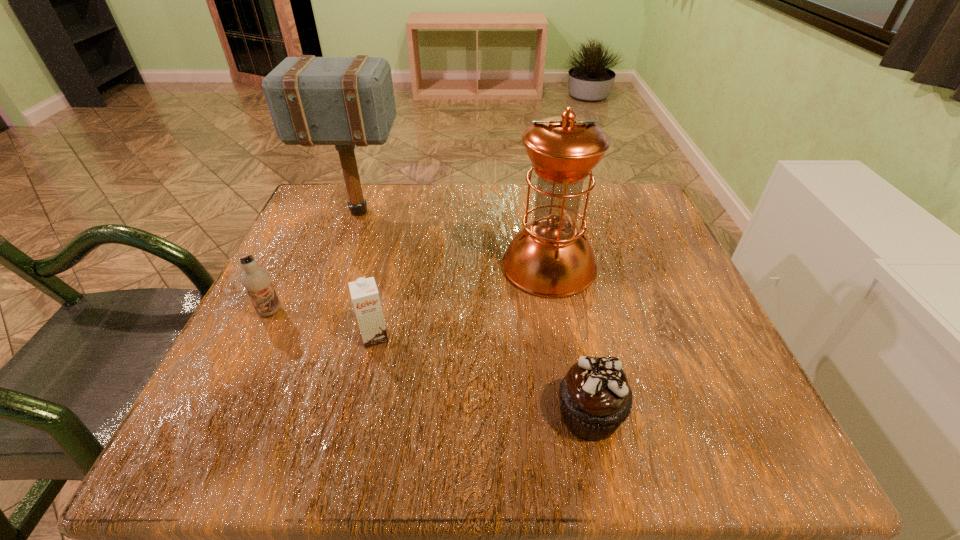
Locate an element on the screen. free space between the farther chocolate milk and the fourth nearest object is located at coordinates (410, 288).

Find the location of a particular element. free space that is in between the third farthest object and the nearest object is located at coordinates (430, 363).

You are a GUI agent. You are given a task and a screenshot of the screen. Output one action in this format:
    pyautogui.click(x=<x>, y=<y>)
    Task: Click on the free spot between the third farthest object and the shortest object
    This screenshot has width=960, height=540.
    Given the screenshot: What is the action you would take?
    pyautogui.click(x=430, y=363)

Identify the location of vacant area between the left chocolate milk and the right chocolate milk. Image resolution: width=960 pixels, height=540 pixels. pos(323,324).

At what (x,y) coordinates should I click in order to perform the action: click on empty space between the mallet and the fourth nearest object. Please return your answer as a coordinate pair (x, y). This screenshot has width=960, height=540. Looking at the image, I should click on (453, 239).

Where is `the second closest object to the farthest object`? This screenshot has width=960, height=540. the second closest object to the farthest object is located at coordinates (257, 281).

This screenshot has width=960, height=540. Identify the location of the closest object to the second nearest object. (257, 281).

Find the location of `free point that satisfies the following two spatial constraints: 1. on the striking surface of the shortest object; 2. on the left side of the farthest object`. free point that satisfies the following two spatial constraints: 1. on the striking surface of the shortest object; 2. on the left side of the farthest object is located at coordinates (283, 415).

At what (x,y) coordinates should I click in order to perform the action: click on vacant space that satisfies the following two spatial constraints: 1. on the striking surface of the second nearest object; 2. on the right side of the farthest object. Please return your answer as a coordinate pair (x, y). The height and width of the screenshot is (540, 960). Looking at the image, I should click on (312, 336).

The image size is (960, 540). I want to click on free location that satisfies the following two spatial constraints: 1. on the back side of the nearer chocolate milk; 2. on the striking surface of the mallet, so click(x=403, y=212).